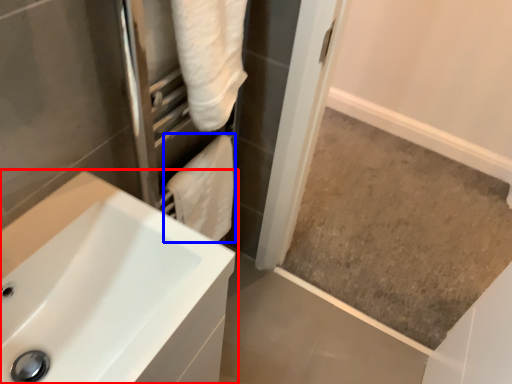
Question: Among these objects, which one is nearest to the camera, sink (highlighted by a red box) or bath towel (highlighted by a blue box)?

Choices:
 (A) sink
 (B) bath towel

Answer: (A)